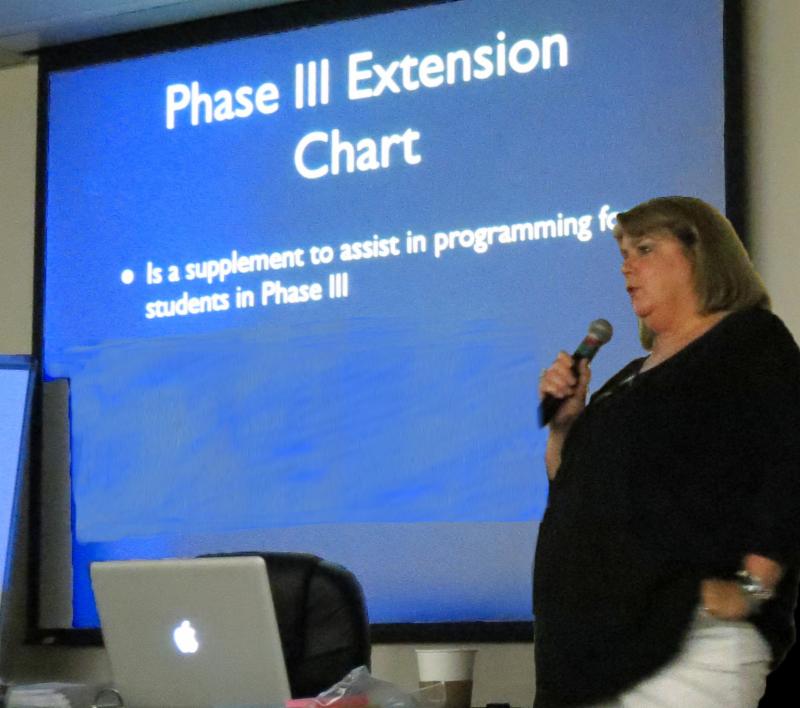
Where is `chart`? The width and height of the screenshot is (800, 708). chart is located at coordinates (329, 171).